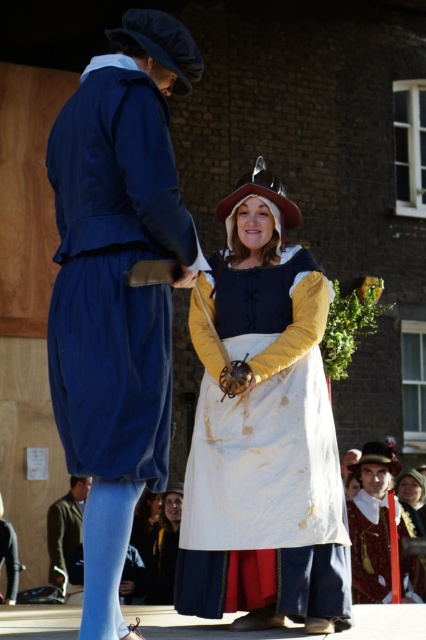
Question: Which point appears farthest from the camera in this image?

Choices:
 (A) (123, 166)
 (B) (172, 573)

Answer: (B)

Question: Which point is farther to the camera?

Choices:
 (A) (49, 556)
 (B) (354, 454)
 (C) (169, 579)
 (D) (236, 550)

Answer: (B)

Question: Does matte yellow fabric dress at center appear on the left side of white cotton apron at center?

Choices:
 (A) yes
 (B) no

Answer: (B)

Question: Which object is the closest to the velvet blue robe at center?

Choices:
 (A) matte yellow fabric dress at center
 (B) velvet maroon robe at lower right

Answer: (A)

Question: Does velvet maroon robe at lower right have a smaller size compared to green fabric jacket at lower left?

Choices:
 (A) yes
 (B) no

Answer: (B)

Question: Does velvet maroon robe at lower right appear on the left side of smooth brown leather hat at upper center?

Choices:
 (A) yes
 (B) no

Answer: (B)